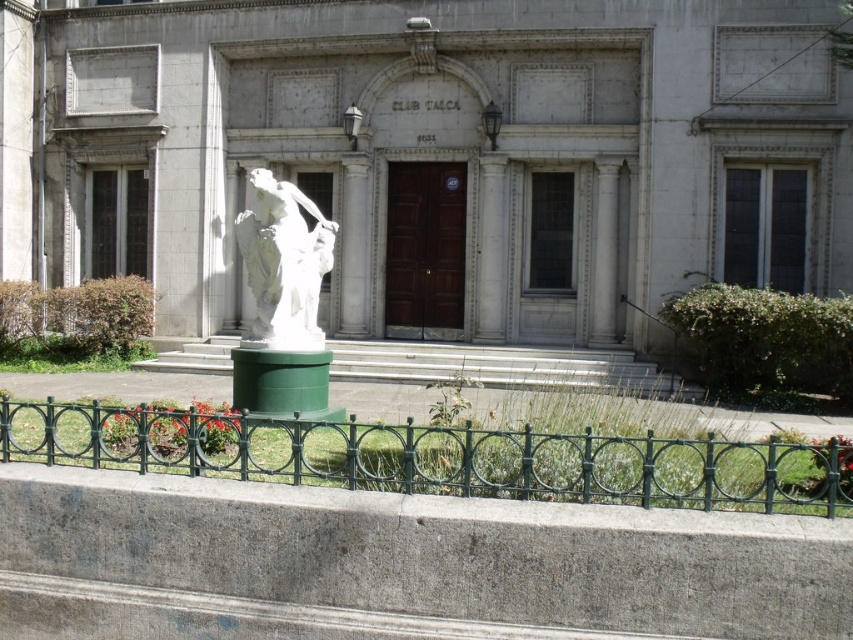
Which is below, green wrought iron fence at lower center or white marble statue at center?

green wrought iron fence at lower center is lower down.

I want to click on green wrought iron fence at lower center, so [x=434, y=458].